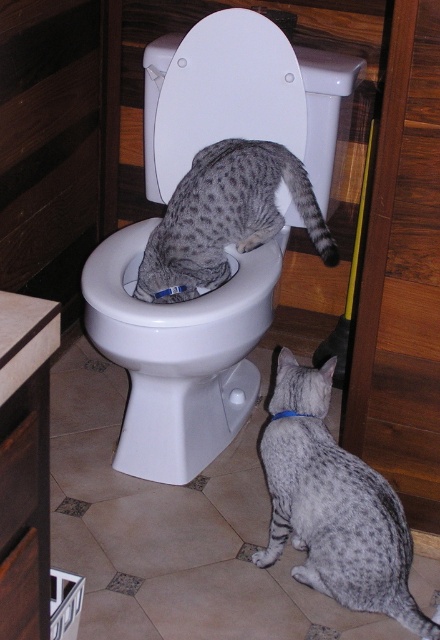
Locate an element on the screen. This screenshot has height=640, width=440. white glossy toilet lid at center is located at coordinates (222, 93).

Does white glossy toilet lid at center appear on the left side of spotted fur cat at center?

Correct, you'll find white glossy toilet lid at center to the left of spotted fur cat at center.

Is point (198, 38) behind point (316, 211)?

No, it is not.

Identify the location of white glossy toilet lid at center. (222, 93).

You are a GUI agent. You are given a task and a screenshot of the screen. Output one action in this format:
    pyautogui.click(x=<x>, y=<y>)
    Task: Click on the white glossy toilet bowl at center
    This screenshot has height=640, width=440.
    Given the screenshot: What is the action you would take?
    pyautogui.click(x=179, y=355)

Does white glossy toilet bowl at center have a greater width compared to spotted fur cat at lower right?

Indeed, white glossy toilet bowl at center has a greater width compared to spotted fur cat at lower right.

Where is `white glossy toilet bowl at center`? The image size is (440, 640). white glossy toilet bowl at center is located at coordinates (179, 355).

Is spotted fur cat at lower right wider than spotted fur cat at center?

No.

This screenshot has width=440, height=640. Describe the element at coordinates (333, 504) in the screenshot. I see `spotted fur cat at lower right` at that location.

Locate an element on the screen. The image size is (440, 640). spotted fur cat at lower right is located at coordinates (333, 504).